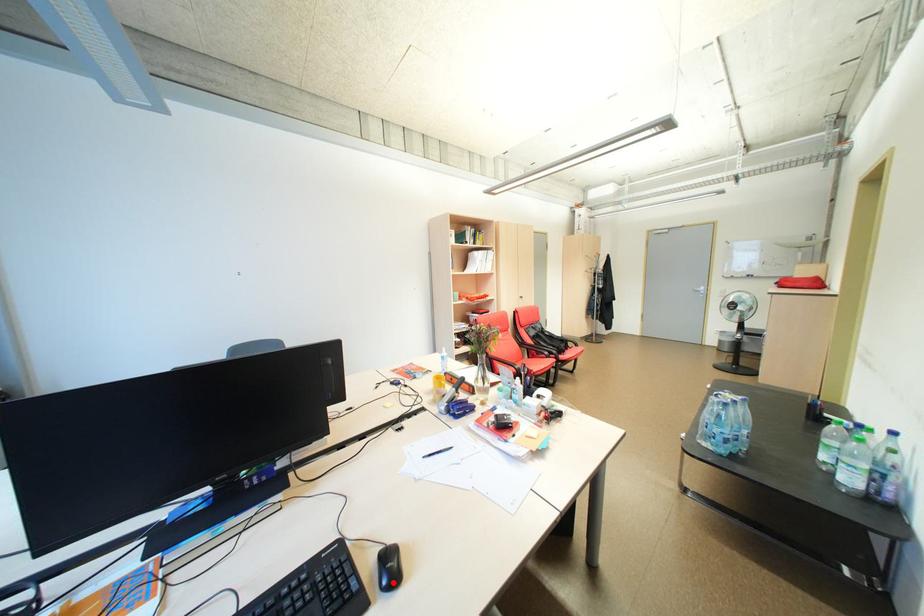
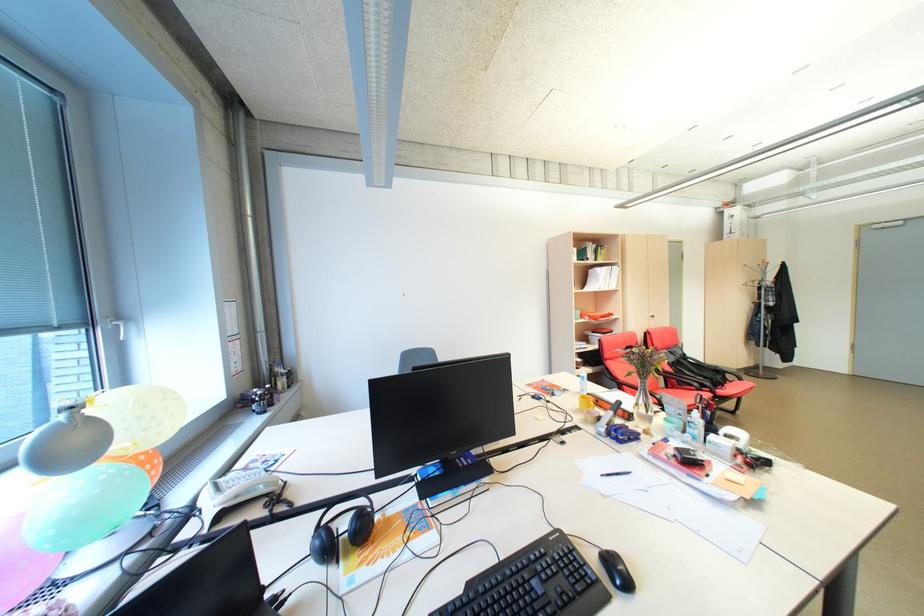
The point at the highlighted location is marked in the first image. Where is the corresponding point in the second image?

(627, 582)